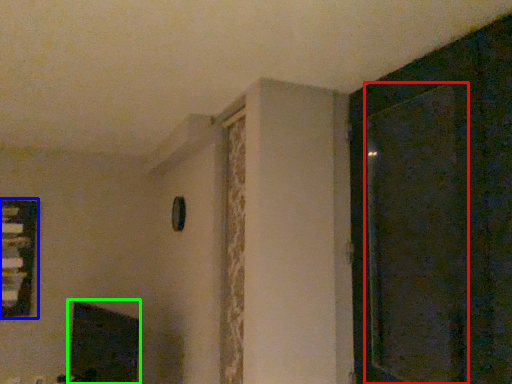
Question: Based on their relative distances, which object is farther from screen door (highlighted by a red box)? Choose from window (highlighted by a blue box) and fireplace (highlighted by a green box).

Choices:
 (A) window
 (B) fireplace

Answer: (A)